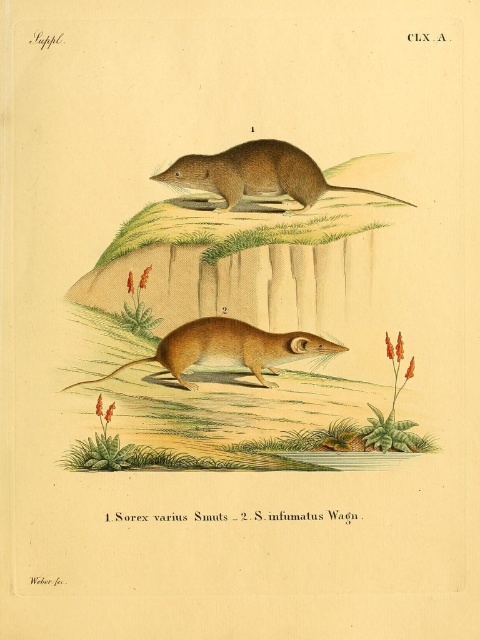
Which is more to the right, brown furry mouse at upper center or golden-brown fur mouse at center?

brown furry mouse at upper center

Does brown furry mouse at upper center have a lesser height compared to golden-brown fur mouse at center?

No, brown furry mouse at upper center is not shorter than golden-brown fur mouse at center.

Is point (216, 182) closer to viewer compared to point (279, 333)?

Yes, it is.

What are the coordinates of `brown furry mouse at upper center` in the screenshot? It's located at (257, 173).

Who is higher up, brown fur mouse at center or brown furry mouse at upper center?

brown furry mouse at upper center is higher up.

Find the location of `brown fur mouse at center`. brown fur mouse at center is located at coordinates (242, 330).

Is brown fur mouse at center to the left of golden-brown fur mouse at center from the viewer's perspective?

In fact, brown fur mouse at center is to the right of golden-brown fur mouse at center.

What do you see at coordinates (242, 330) in the screenshot? The width and height of the screenshot is (480, 640). I see `brown fur mouse at center` at bounding box center [242, 330].

Where is `brown fur mouse at center`? This screenshot has height=640, width=480. brown fur mouse at center is located at coordinates (242, 330).